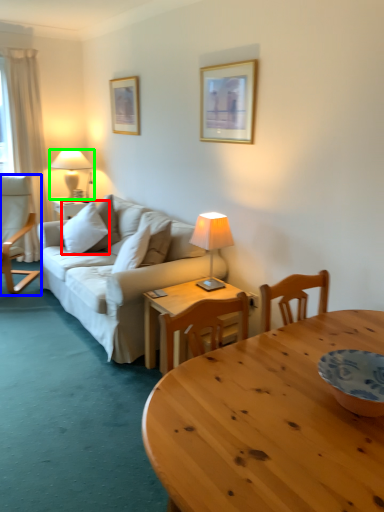
Question: Based on their relative distances, which object is farther from pillow (highlighted by a red box)? Choose from chair (highlighted by a blue box) and lamp (highlighted by a green box).

Choices:
 (A) chair
 (B) lamp

Answer: (B)